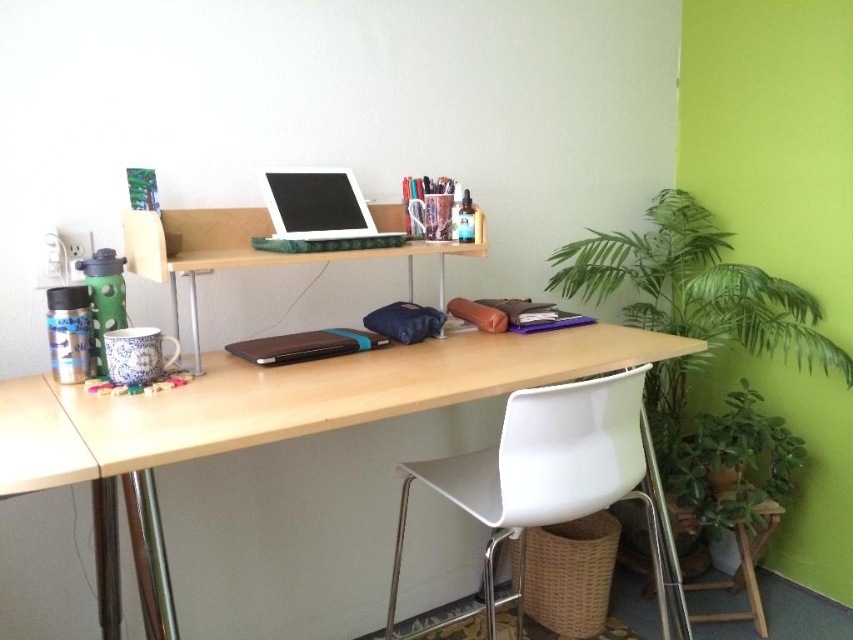
Between point (750, 467) and point (744, 612), which one is positioned behind?

The point (750, 467) is more distant.

Is green leafy plant at lower right bigger than white plastic stool at lower right?

Indeed, green leafy plant at lower right has a larger size compared to white plastic stool at lower right.

The width and height of the screenshot is (853, 640). What are the coordinates of `green leafy plant at lower right` in the screenshot? It's located at (733, 461).

How far apart are wooden laptop at center and white plastic stool at lower right?

A distance of 1.30 meters exists between wooden laptop at center and white plastic stool at lower right.

Which of these two, wooden laptop at center or white plastic stool at lower right, stands shorter?

white plastic stool at lower right is shorter.

Find the location of a particular element. This screenshot has height=640, width=853. wooden laptop at center is located at coordinates (242, 252).

Is green leafy plant at lower right to the left of green marble laptop at center from the viewer's perspective?

Incorrect, green leafy plant at lower right is not on the left side of green marble laptop at center.

Image resolution: width=853 pixels, height=640 pixels. What do you see at coordinates (733, 461) in the screenshot?
I see `green leafy plant at lower right` at bounding box center [733, 461].

Where is `green leafy plant at lower right`? green leafy plant at lower right is located at coordinates (733, 461).

Where is `green leafy plant at lower right`? The image size is (853, 640). green leafy plant at lower right is located at coordinates (733, 461).